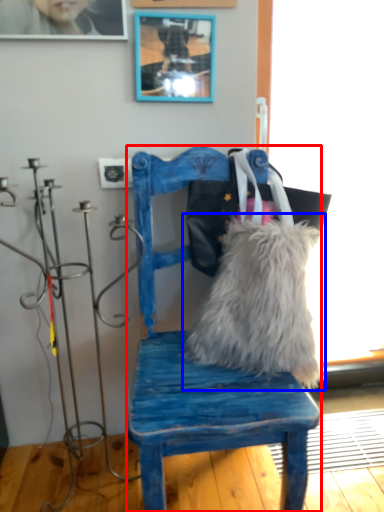
Question: Which object appears farthest to the camera in this image, chair (highlighted by a red box) or pillow (highlighted by a blue box)?

Choices:
 (A) chair
 (B) pillow

Answer: (B)